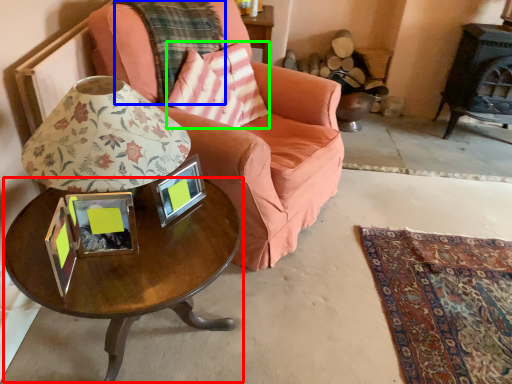
Question: Which object is positioned closest to coffee table (highlighted by a red box)? Select from plaid (highlighted by a blue box) and throw pillow (highlighted by a green box).

Choices:
 (A) plaid
 (B) throw pillow

Answer: (B)